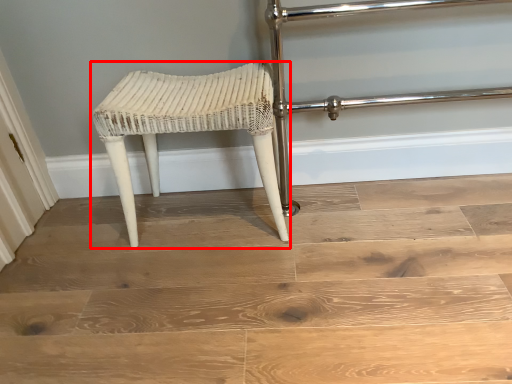
Question: Considering the relative positions of stool (annotated by the red box) and stairwell in the image provided, where is stool (annotated by the red box) located with respect to the staircase?

Choices:
 (A) right
 (B) left

Answer: (B)